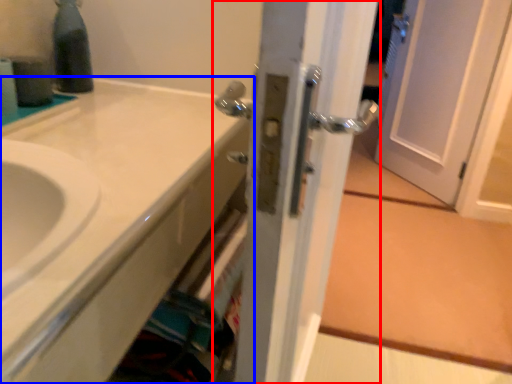
Question: Which object is further to the camera taking this photo, door (highlighted by a red box) or bathroom cabinet (highlighted by a blue box)?

Choices:
 (A) door
 (B) bathroom cabinet

Answer: (B)